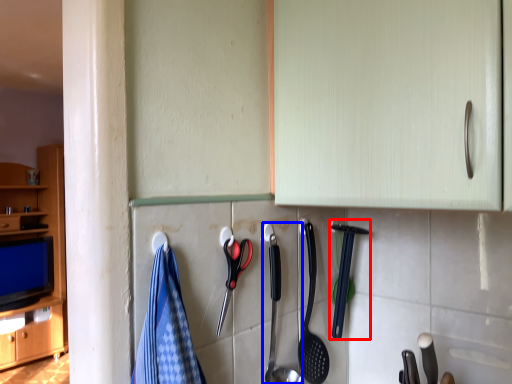
Question: Which object is further to the camera taking this photo, silverware (highlighted by a red box) or silverware (highlighted by a blue box)?

Choices:
 (A) silverware
 (B) silverware

Answer: (A)